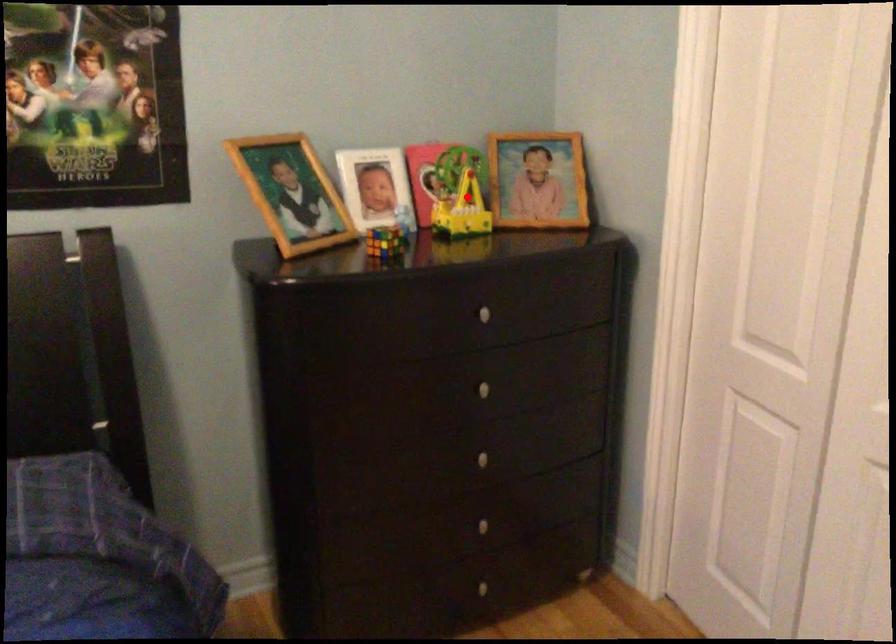
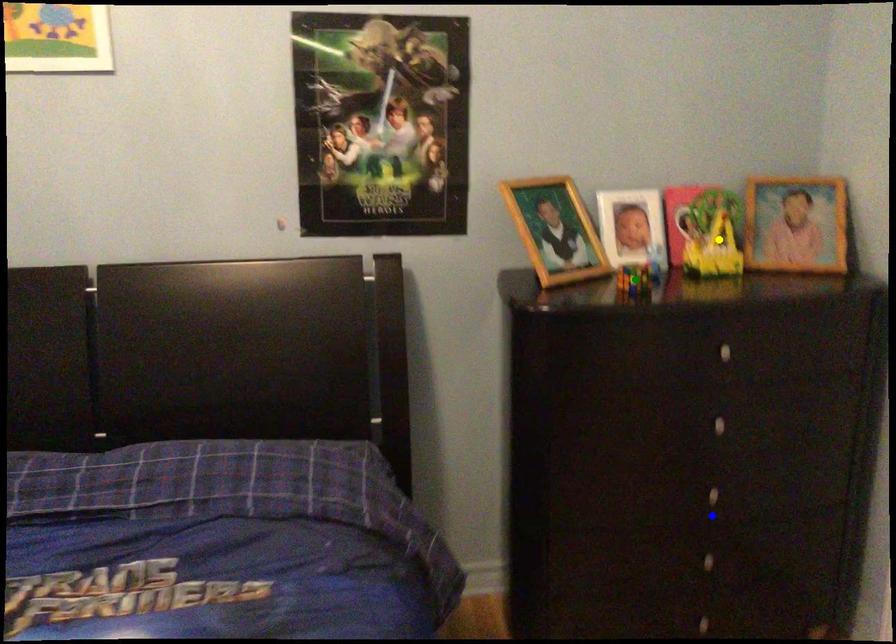
Question: I am providing you with two images of the same scene from different viewpoints. A red point is marked on the first image. You are given multiple points on the second image. Which point in image 2 represents the same 3d spot as the red point in image 1?

Choices:
 (A) yellow point
 (B) blue point
 (C) green point

Answer: (A)